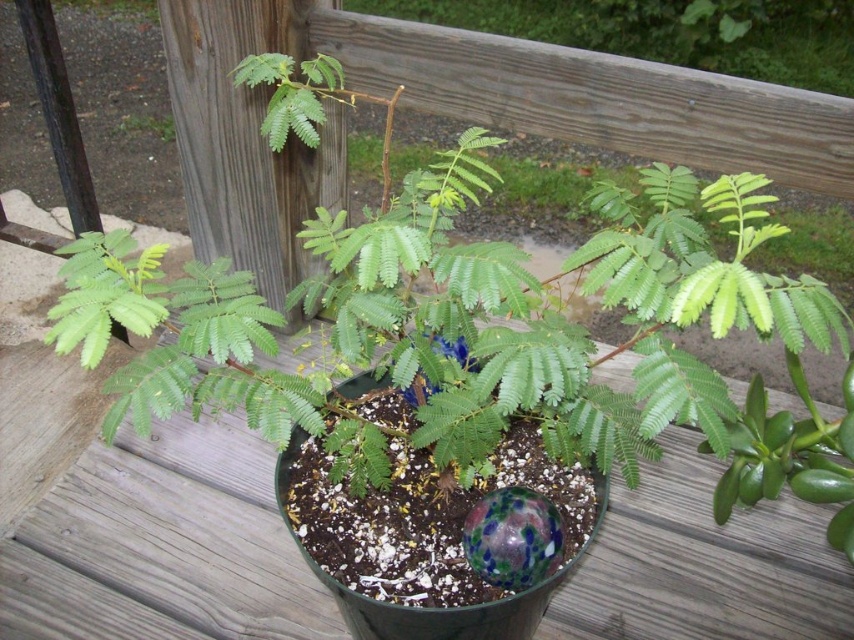
You are standing on the wooden deck and want to water both the green matte plant at upper center and the green leafy plant at upper left. Which plant should you water first if you want to start with the one closer to you?

You should water the green matte plant at upper center first because it is closer to you than the green leafy plant at upper left.

You are a gardener inspecting the plants on the deck. You see the green matte plant at upper center and the green leafy plant at upper left. Which plant is positioned to the right side of the other?

The green matte plant at upper center is positioned to the right of the green leafy plant at upper left.